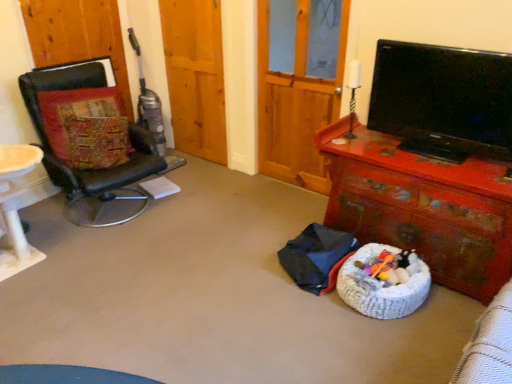
This screenshot has height=384, width=512. In order to click on wooden screen door at center, which is the 1th screen door in right-to-left order in this screenshot , I will do `click(297, 98)`.

Describe the element at coordinates (86, 127) in the screenshot. The width and height of the screenshot is (512, 384). I see `textured fabric pillow at left` at that location.

Locate an element on the screen. black glossy flat-screen tv at upper right is located at coordinates (443, 100).

What are the coordinates of `white woven dog bed at lower center` in the screenshot? It's located at pyautogui.click(x=381, y=287).

Which object is closer to the camera taking this photo, black leather chair at left or white woven dog bed at lower center?

white woven dog bed at lower center.

Is black leather chair at left shorter than white woven dog bed at lower center?

No, black leather chair at left is not shorter than white woven dog bed at lower center.

Is black leather chair at left not near white woven dog bed at lower center?

Yes, black leather chair at left is far from white woven dog bed at lower center.

Can white woven dog bed at lower center be found inside black leather chair at left?

No, white woven dog bed at lower center is located outside of black leather chair at left.

Which point is more forward, (305, 15) or (354, 278)?

Positioned in front is point (354, 278).

Is wooden screen door at center, which is the 1th screen door in right-to-left order, positioned in front of white woven dog bed at lower center?

No.

Consider the image. Can you confirm if wooden screen door at center, the 2th screen door in the left-to-right sequence, is bigger than white woven dog bed at lower center?

Yes, wooden screen door at center, the 2th screen door in the left-to-right sequence, is bigger than white woven dog bed at lower center.

From a real-world perspective, is wooden screen door at center, the 2th screen door in the left-to-right sequence, located beneath white woven dog bed at lower center?

No, from a real-world perspective, wooden screen door at center, the 2th screen door in the left-to-right sequence, is not below white woven dog bed at lower center.

Which point is more forward, (83, 180) or (467, 71)?

The point (467, 71) is more forward.

From the picture: Is black leather chair at left bigger than black glossy flat-screen tv at upper right?

Yes.

Does black leather chair at left have a lesser height compared to black glossy flat-screen tv at upper right?

No.

Would you say black leather chair at left is to the left or to the right of black glossy flat-screen tv at upper right in the picture?

black leather chair at left is positioned on black glossy flat-screen tv at upper right's left side.

Between wooden screen door at center, which is the 1th screen door in right-to-left order, and dark blue fabric at center, which one has less height?

dark blue fabric at center.

Is the depth of wooden screen door at center, the 2th screen door in the left-to-right sequence, less than that of dark blue fabric at center?

No, the depth of wooden screen door at center, the 2th screen door in the left-to-right sequence, is greater than that of dark blue fabric at center.

From the image's perspective, which one is positioned higher, wooden screen door at center, the 2th screen door in the left-to-right sequence, or dark blue fabric at center?

wooden screen door at center, the 2th screen door in the left-to-right sequence, is shown above in the image.

Considering the relative positions of wooden screen door at center, which is the 1th screen door in right-to-left order, and dark blue fabric at center in the image provided, is wooden screen door at center, which is the 1th screen door in right-to-left order, to the right of dark blue fabric at center from the viewer's perspective?

Incorrect, wooden screen door at center, which is the 1th screen door in right-to-left order, is not on the right side of dark blue fabric at center.

Could you tell me if white woven dog bed at lower center is facing dark blue fabric at center?

No, white woven dog bed at lower center does not turn towards dark blue fabric at center.

Can you confirm if white woven dog bed at lower center is taller than dark blue fabric at center?

No.

Based on the photo, which is farther, (388, 309) or (312, 291)?

The point (312, 291) is behind.

Can you tell me how much white woven dog bed at lower center and dark blue fabric at center differ in facing direction?

The angular difference between white woven dog bed at lower center and dark blue fabric at center is 88.6 degrees.

Does textured fabric pillow at left have a smaller size compared to white woven dog bed at lower center?

Incorrect, textured fabric pillow at left is not smaller in size than white woven dog bed at lower center.

Which point is more forward, (98,120) or (358,253)?

Point (358,253)

Identify the location of dog bed directly beneath the textured fabric pillow at left (from a real-world perspective). Image resolution: width=512 pixels, height=384 pixels. (381, 287).

Is dark blue fabric at center to the left of rusty wooden desk at lower right from the viewer's perspective?

Indeed, dark blue fabric at center is positioned on the left side of rusty wooden desk at lower right.

From a real-world perspective, is dark blue fabric at center over rusty wooden desk at lower right?

No, from a real-world perspective, dark blue fabric at center is not over rusty wooden desk at lower right

Measure the distance from dark blue fabric at center to rusty wooden desk at lower right.

dark blue fabric at center is 41.51 centimeters away from rusty wooden desk at lower right.

In terms of size, does dark blue fabric at center appear bigger or smaller than rusty wooden desk at lower right?

Considering their sizes, dark blue fabric at center takes up less space than rusty wooden desk at lower right.

The width and height of the screenshot is (512, 384). In order to click on dog bed that appears on the right of black leather chair at left in this screenshot , I will do pos(381,287).

The image size is (512, 384). What are the coordinates of `dog bed that appears in front of the wooden screen door at center, which is the 1th screen door in right-to-left order` in the screenshot? It's located at (381, 287).

When comparing their distances from black leather chair at left, does textured fabric pillow at left or rusty wooden desk at lower right seem further?

rusty wooden desk at lower right is further to black leather chair at left.

Based on their spatial positions, is textured fabric pillow at left or wooden screen door at upper center, which is counted as the 1th screen door, starting from the left, further from white woven dog bed at lower center?

wooden screen door at upper center, which is counted as the 1th screen door, starting from the left.

From the image, which object appears to be nearer to wooden screen door at upper center, acting as the second screen door starting from the right, white woven dog bed at lower center or wooden screen door at center, which is the 1th screen door in right-to-left order?

wooden screen door at center, which is the 1th screen door in right-to-left order, is positioned closer to the anchor wooden screen door at upper center, acting as the second screen door starting from the right.

Looking at the image, which one is located further to wooden screen door at upper center, which is counted as the 1th screen door, starting from the left, white woven dog bed at lower center or dark blue fabric at center?

white woven dog bed at lower center is positioned further to the anchor wooden screen door at upper center, which is counted as the 1th screen door, starting from the left.

Estimate the real-world distances between objects in this image. Which object is closer to dark blue fabric at center, black leather chair at left or wooden screen door at center, which is the 1th screen door in right-to-left order?

Based on the image, wooden screen door at center, which is the 1th screen door in right-to-left order, appears to be nearer to dark blue fabric at center.

Considering their positions, is black leather chair at left positioned further to wooden screen door at upper center, acting as the second screen door starting from the right, than rusty wooden desk at lower right?

Among the two, rusty wooden desk at lower right is located further to wooden screen door at upper center, acting as the second screen door starting from the right.

Looking at this image, when comparing their distances from textured fabric pillow at left, does wooden screen door at upper center, which is counted as the 1th screen door, starting from the left, or wooden screen door at center, which is the 1th screen door in right-to-left order, seem closer?

Based on the image, wooden screen door at upper center, which is counted as the 1th screen door, starting from the left, appears to be nearer to textured fabric pillow at left.

From the image, which object appears to be farther from black glossy flat-screen tv at upper right, black leather chair at left or rusty wooden desk at lower right?

black leather chair at left.

Find the location of a particular element. The image size is (512, 384). screen door between textured fabric pillow at left and wooden screen door at center, the 2th screen door in the left-to-right sequence is located at coordinates (195, 76).

The height and width of the screenshot is (384, 512). In order to click on material situated between wooden screen door at upper center, acting as the second screen door starting from the right, and rusty wooden desk at lower right from left to right in this screenshot , I will do coord(317,257).

Identify the location of material between black leather chair at left and black glossy flat-screen tv at upper right from left to right. This screenshot has width=512, height=384. (317, 257).

Find the location of `dog bed between dark blue fabric at center and rusty wooden desk at lower right from left to right`. dog bed between dark blue fabric at center and rusty wooden desk at lower right from left to right is located at coordinates (381, 287).